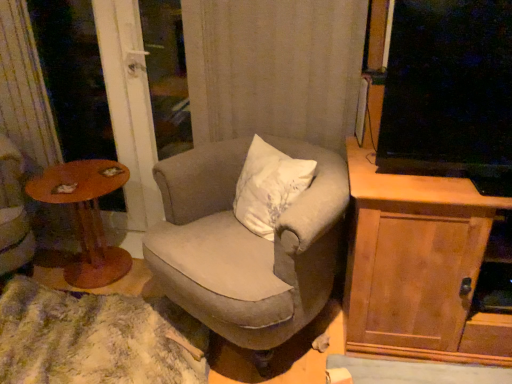
Question: From a real-world perspective, is wooden round table at left on textured beige armchair at center?

Choices:
 (A) no
 (B) yes

Answer: (A)

Question: Is wooden round table at left not near textured beige armchair at center?

Choices:
 (A) yes
 (B) no

Answer: (B)

Question: Can you confirm if wooden round table at left is thinner than textured beige armchair at center?

Choices:
 (A) yes
 (B) no

Answer: (A)

Question: Can you confirm if wooden round table at left is smaller than textured beige armchair at center?

Choices:
 (A) yes
 (B) no

Answer: (A)

Question: Is wooden round table at left shorter than textured beige armchair at center?

Choices:
 (A) no
 (B) yes

Answer: (B)

Question: Based on their sizes in the image, would you say wooden cabinet at right is bigger or smaller than transparent glass screen door at left?

Choices:
 (A) big
 (B) small

Answer: (A)

Question: Does point (372, 236) appear closer or farther from the camera than point (87, 142)?

Choices:
 (A) closer
 (B) farther

Answer: (A)

Question: Which is correct: wooden cabinet at right is inside transparent glass screen door at left, or outside of it?

Choices:
 (A) inside
 (B) outside

Answer: (B)

Question: In terms of width, does wooden cabinet at right look wider or thinner when compared to transparent glass screen door at left?

Choices:
 (A) wide
 (B) thin

Answer: (A)

Question: Considering the positions of point (69, 200) and point (44, 311), is point (69, 200) closer or farther from the camera than point (44, 311)?

Choices:
 (A) farther
 (B) closer

Answer: (A)

Question: From a real-world perspective, is wooden round table at left physically located above or below fuzzy carpet at lower left?

Choices:
 (A) above
 (B) below

Answer: (A)

Question: Relative to fuzzy carpet at lower left, is wooden round table at left in front or behind?

Choices:
 (A) behind
 (B) front

Answer: (A)

Question: From the image's perspective, relative to fuzzy carpet at lower left, is wooden round table at left above or below?

Choices:
 (A) above
 (B) below

Answer: (A)

Question: From the image's perspective, is fuzzy carpet at lower left positioned above or below textured beige armchair at center?

Choices:
 (A) below
 (B) above

Answer: (A)

Question: Considering the positions of fuzzy carpet at lower left and textured beige armchair at center in the image, is fuzzy carpet at lower left bigger or smaller than textured beige armchair at center?

Choices:
 (A) small
 (B) big

Answer: (A)